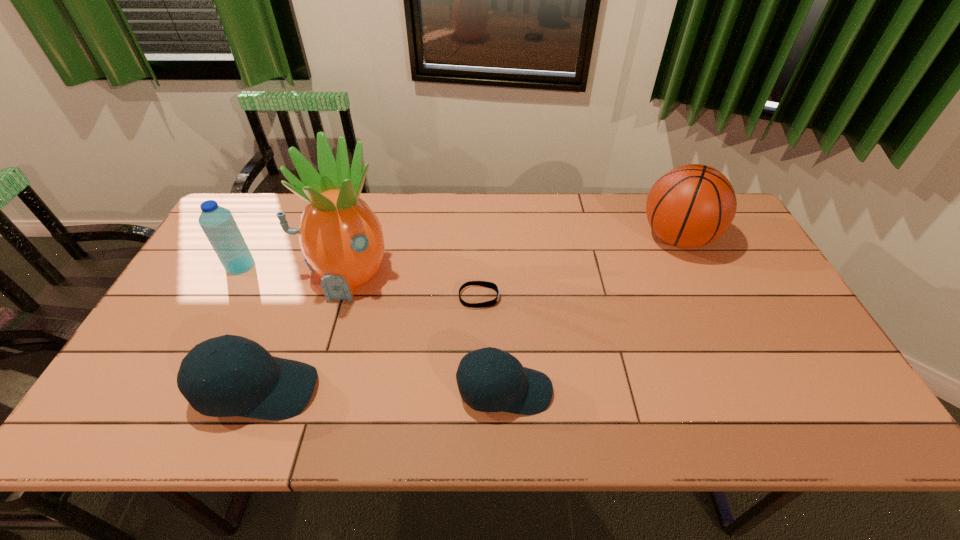
Locate which object is the fourth closest to the shortest object. Please provide its 2D coordinates. Your answer should be formatted as a tuple, i.e. [(x, y)], where the tuple contains the x and y coordinates of a point satisfying the conditions above.

[(692, 205)]

The height and width of the screenshot is (540, 960). Find the location of `free space that satisfies the following two spatial constraints: 1. at the entrance of the pineapple; 2. on the front-facing side of the third shortest object`. free space that satisfies the following two spatial constraints: 1. at the entrance of the pineapple; 2. on the front-facing side of the third shortest object is located at coordinates (312, 390).